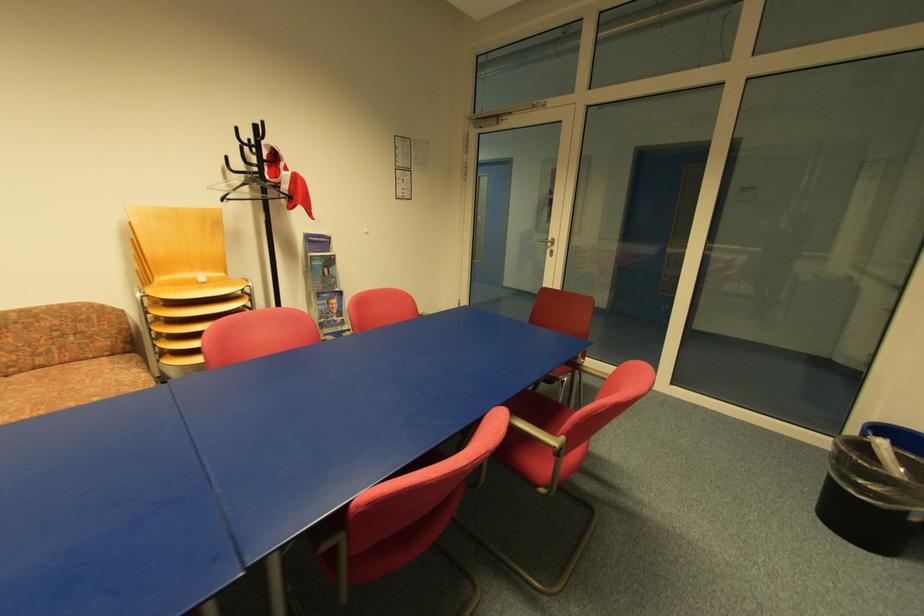
Find where to resting arm the patterned sofa armrest. Please return your answer as a coordinate pair (x, y).

(146, 350)